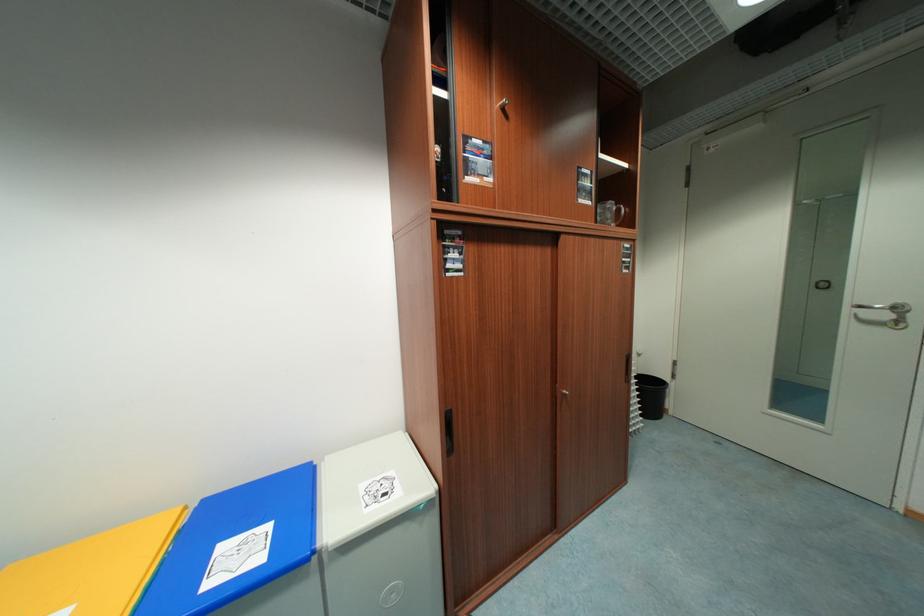
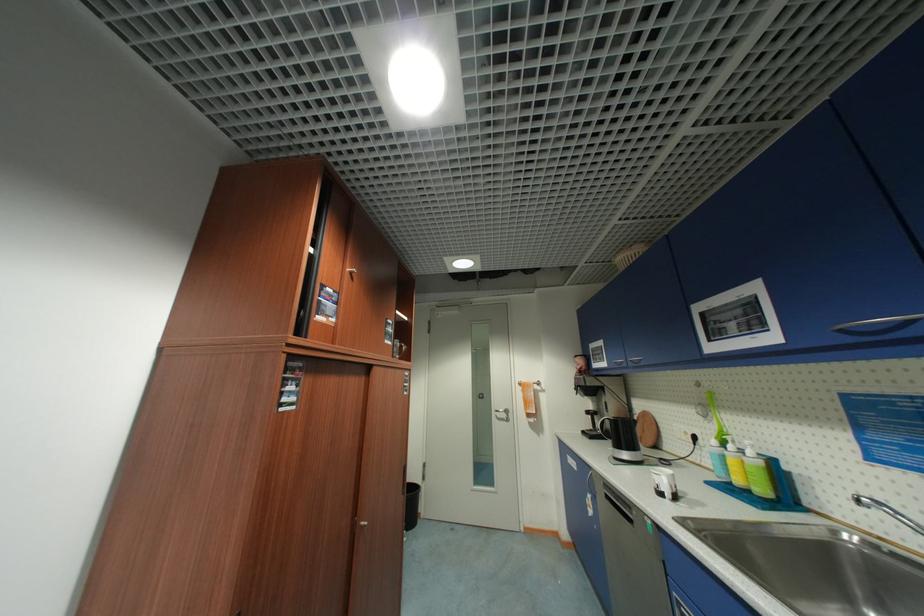
The first image is from the beginning of the video and the second image is from the end. How did the camera likely rotate when shooting the video?

The camera rotated toward right-up.